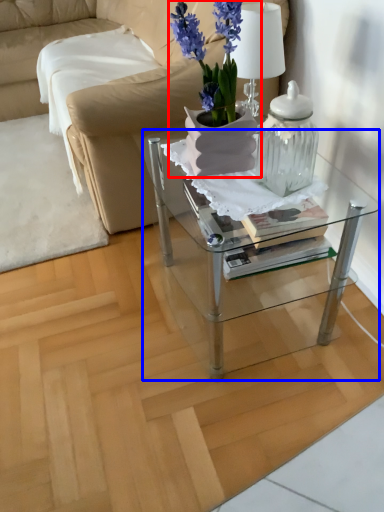
Question: Which object is closer to the camera taking this photo, houseplant (highlighted by a red box) or table (highlighted by a blue box)?

Choices:
 (A) houseplant
 (B) table

Answer: (A)